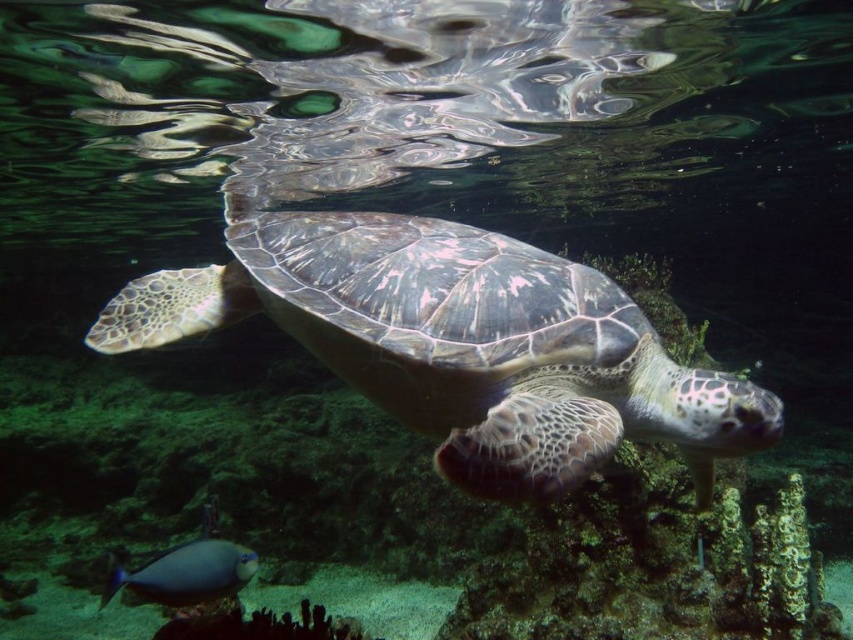
Question: Does leathery green turtle at center have a larger size compared to shiny blue fish at lower left?

Choices:
 (A) no
 (B) yes

Answer: (B)

Question: Which point is closer to the camera?

Choices:
 (A) leathery green turtle at center
 (B) shiny blue fish at lower left

Answer: (A)

Question: Does leathery green turtle at center appear under shiny blue fish at lower left?

Choices:
 (A) no
 (B) yes

Answer: (A)

Question: Is leathery green turtle at center below shiny blue fish at lower left?

Choices:
 (A) no
 (B) yes

Answer: (A)